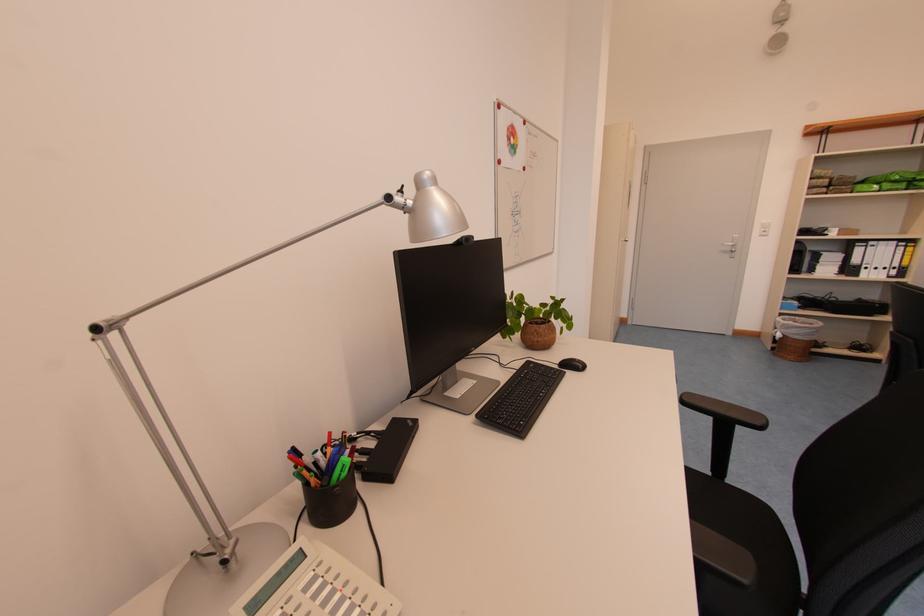
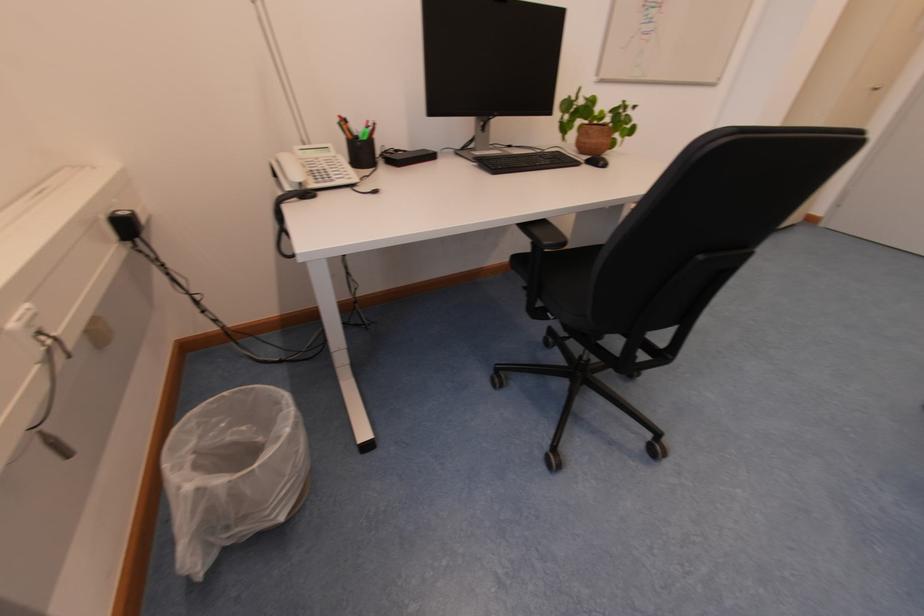
In the second image, find the point that corresponds to (564,369) in the first image.

(590, 164)